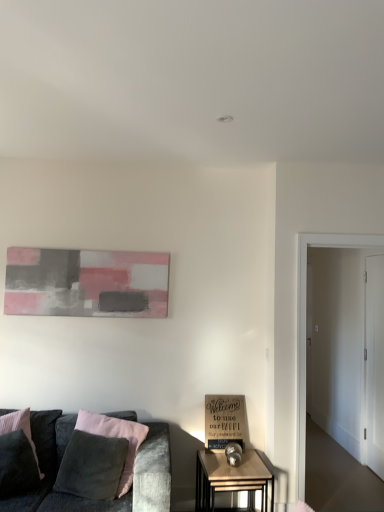
This screenshot has width=384, height=512. What do you see at coordinates (19, 428) in the screenshot?
I see `dark gray fabric pillow at lower left` at bounding box center [19, 428].

Identify the location of white glossy door at right, positioned as the 2th glass door in left-to-right order. (374, 362).

Identify the location of white glossy door at right, which ranks as the first glass door in front-to-back order. This screenshot has width=384, height=512. (305, 330).

Describe the element at coordinates (88, 499) in the screenshot. Image resolution: width=384 pixels, height=512 pixels. I see `velvet grey couch at lower left` at that location.

This screenshot has height=512, width=384. I want to click on abstract painting at upper left, so click(x=86, y=283).

Between wooden signboard at lower center and wooden side table at lower center, which one has larger width?

With larger width is wooden side table at lower center.

Could you tell me if wooden signboard at lower center is facing wooden side table at lower center?

No, wooden signboard at lower center does not turn towards wooden side table at lower center.

Can you confirm if wooden signboard at lower center is shorter than wooden side table at lower center?

Yes, wooden signboard at lower center is shorter than wooden side table at lower center.

Consider the image. In the image, is wooden signboard at lower center positioned in front of or behind wooden side table at lower center?

Visually, wooden signboard at lower center is located behind wooden side table at lower center.

Based on the photo, which object is positioned more to the right, wooden signboard at lower center or white glossy door at right, placed as the 2th glass door when sorted from right to left?

From the viewer's perspective, white glossy door at right, placed as the 2th glass door when sorted from right to left, appears more on the right side.

From the image's perspective, who appears lower, wooden signboard at lower center or white glossy door at right, placed as the 2th glass door when sorted from right to left?

wooden signboard at lower center is shown below in the image.

Locate an element on the screen. This screenshot has width=384, height=512. cardboard box that appears behind the white glossy door at right, placed as the 2th glass door when sorted from right to left is located at coordinates (224, 421).

Considering the positions of point (213, 420) and point (298, 238), is point (213, 420) closer or farther from the camera than point (298, 238)?

Point (213, 420) is farther from the camera than point (298, 238).

Is point (15, 426) positioned behind point (375, 355)?

That is False.

From their relative heights in the image, would you say dark gray fabric pillow at lower left is taller or shorter than white glossy door at right, which is the first glass door in right-to-left order?

Clearly, dark gray fabric pillow at lower left is shorter compared to white glossy door at right, which is the first glass door in right-to-left order.

From a real-world perspective, which object rests below the other?

dark gray fabric pillow at lower left, from a real-world perspective.

Which of these two, dark gray fabric pillow at lower left or white glossy door at right, the second glass door viewed from the front, is bigger?

With larger size is dark gray fabric pillow at lower left.

Is velvet grey couch at lower left facing away from abstract painting at upper left?

No, velvet grey couch at lower left is not facing the opposite direction of abstract painting at upper left.

Considering the sizes of objects velvet grey couch at lower left and abstract painting at upper left in the image provided, who is smaller, velvet grey couch at lower left or abstract painting at upper left?

abstract painting at upper left is smaller.

Is velvet grey couch at lower left outside of abstract painting at upper left?

Absolutely, velvet grey couch at lower left is external to abstract painting at upper left.

Which is closer, [152,473] or [99,289]?

The point [152,473] is more forward.

Between dark gray fabric pillow at lower left and abstract painting at upper left, which one has larger width?

dark gray fabric pillow at lower left.

How different are the orientations of dark gray fabric pillow at lower left and abstract painting at upper left in degrees?

They differ by 35.7 degrees in their facing directions.

Considering the positions of point (9, 428) and point (169, 257), is point (9, 428) closer or farther from the camera than point (169, 257)?

Point (9, 428) is closer to the camera than point (169, 257).

Can you confirm if dark gray fabric pillow at lower left is positioned to the left of abstract painting at upper left?

Correct, you'll find dark gray fabric pillow at lower left to the left of abstract painting at upper left.

From the image's perspective, which object appears higher, velvet grey couch at lower left or wooden signboard at lower center?

wooden signboard at lower center, from the image's perspective.

How many degrees apart are the facing directions of velvet grey couch at lower left and wooden signboard at lower center?

velvet grey couch at lower left and wooden signboard at lower center are facing 0.528 degrees away from each other.

Is velvet grey couch at lower left positioned with its back to wooden signboard at lower center?

velvet grey couch at lower left is not turned away from wooden signboard at lower center.

Choose the correct answer: Is velvet grey couch at lower left inside wooden signboard at lower center or outside it?

velvet grey couch at lower left exists outside the volume of wooden signboard at lower center.

Is white glossy door at right, marked as the first glass door in a left-to-right arrangement, at the right side of wooden side table at lower center?

Correct, you'll find white glossy door at right, marked as the first glass door in a left-to-right arrangement, to the right of wooden side table at lower center.

Is white glossy door at right, placed as the 2th glass door when sorted from right to left, bigger or smaller than wooden side table at lower center?

In the image, white glossy door at right, placed as the 2th glass door when sorted from right to left, appears to be larger than wooden side table at lower center.

Does white glossy door at right, marked as the first glass door in a left-to-right arrangement, have a greater height compared to wooden side table at lower center?

Indeed, white glossy door at right, marked as the first glass door in a left-to-right arrangement, has a greater height compared to wooden side table at lower center.

At what (x,y) coordinates should I click in order to perform the action: click on cardboard box that appears above the wooden side table at lower center (from a real-world perspective). Please return your answer as a coordinate pair (x, y). The height and width of the screenshot is (512, 384). Looking at the image, I should click on (224, 421).

Which glass door is the 1st one when counting from the right side of the wooden signboard at lower center? Please provide its 2D coordinates.

[(305, 330)]

Which object lies nearer to the anchor point velvet grey couch at lower left, dark gray fabric pillow at lower left or white glossy door at right, which is the first glass door in right-to-left order?

dark gray fabric pillow at lower left lies closer to velvet grey couch at lower left than the other object.

Estimate the real-world distances between objects in this image. Which object is further from dark gray fabric pillow at lower left, wooden signboard at lower center or abstract painting at upper left?

wooden signboard at lower center lies further to dark gray fabric pillow at lower left than the other object.

From the image, which object appears to be farther from wooden side table at lower center, abstract painting at upper left or velvet grey couch at lower left?

Among the two, abstract painting at upper left is located further to wooden side table at lower center.

From the image, which object appears to be nearer to white glossy door at right, the second glass door viewed from the front, velvet grey couch at lower left or dark gray fabric pillow at lower left?

velvet grey couch at lower left is closer to white glossy door at right, the second glass door viewed from the front.

Based on their spatial positions, is dark gray fabric pillow at lower left or white glossy door at right, which ranks as the first glass door in front-to-back order, further from abstract painting at upper left?

Based on the image, white glossy door at right, which ranks as the first glass door in front-to-back order, appears to be further to abstract painting at upper left.

When comparing their distances from velvet grey couch at lower left, does dark gray fabric pillow at lower left or white glossy door at right, placed as the 2th glass door when sorted from right to left, seem closer?

dark gray fabric pillow at lower left is positioned closer to the anchor velvet grey couch at lower left.

Looking at the image, which one is located closer to dark gray fabric pillow at lower left, wooden signboard at lower center or white glossy door at right, marked as the 2th glass door in a back-to-front arrangement?

Among the two, wooden signboard at lower center is located nearer to dark gray fabric pillow at lower left.

Looking at the image, which one is located closer to wooden signboard at lower center, white glossy door at right, positioned as the 2th glass door in left-to-right order, or velvet grey couch at lower left?

velvet grey couch at lower left.

This screenshot has width=384, height=512. I want to click on glass door between dark gray fabric pillow at lower left and white glossy door at right, placed as the first glass door when sorted from back to front, in the horizontal direction, so click(x=305, y=330).

Locate an element on the screen. The width and height of the screenshot is (384, 512). glass door situated between wooden side table at lower center and white glossy door at right, which is the first glass door in right-to-left order, from left to right is located at coordinates (305, 330).

Identify the location of table situated between abstract painting at upper left and white glossy door at right, placed as the 2th glass door when sorted from right to left, from left to right. The height and width of the screenshot is (512, 384). (232, 479).

Where is `studio couch between dark gray fabric pillow at lower left and wooden signboard at lower center from left to right`? studio couch between dark gray fabric pillow at lower left and wooden signboard at lower center from left to right is located at coordinates (88, 499).